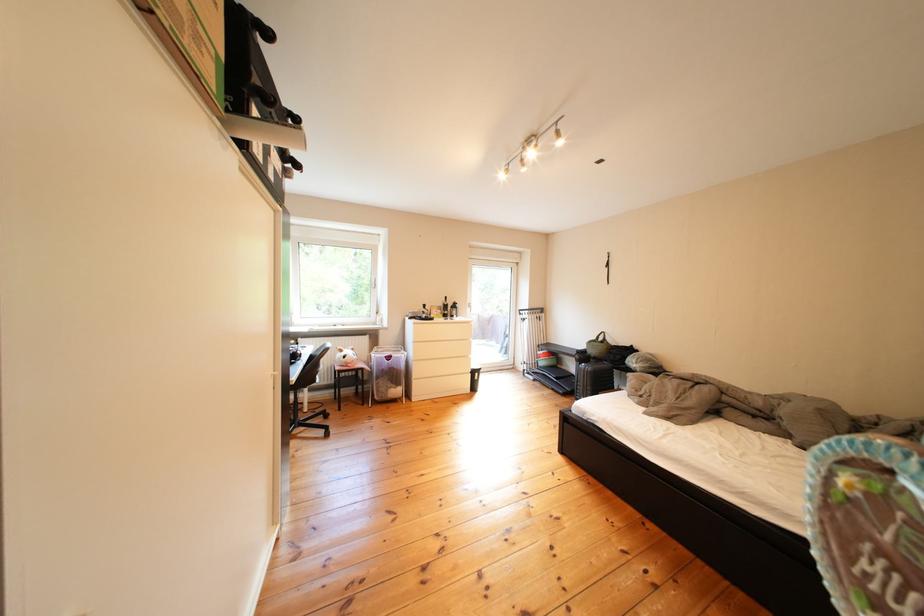
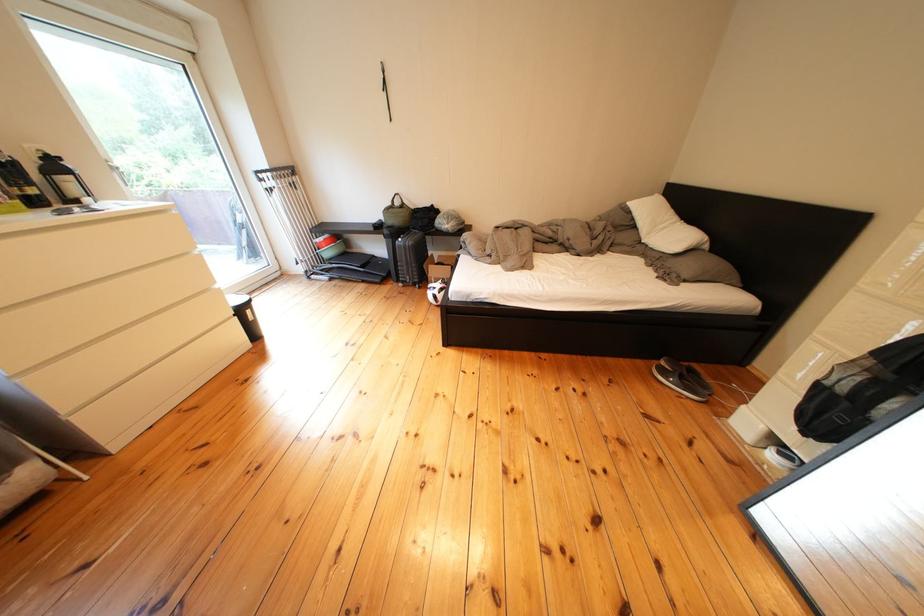
Where in the second image is the point corresponding to [480,361] from the first image?

(220, 294)